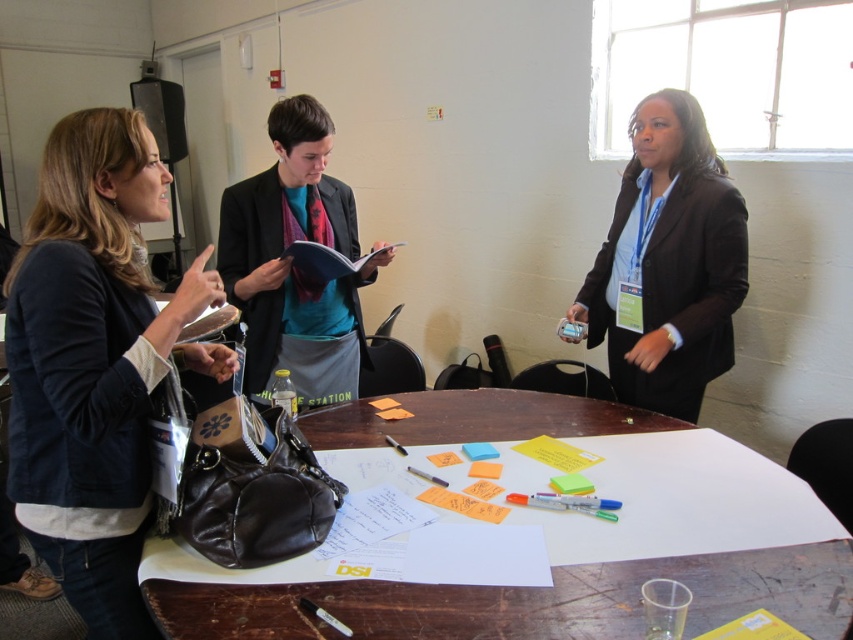
Question: Is dark blue leather jacket at left smaller than black matte blazer at center?

Choices:
 (A) yes
 (B) no

Answer: (A)

Question: Among these points, which one is farthest from the camera?

Choices:
 (A) (103, 545)
 (B) (457, 438)

Answer: (B)

Question: Among these objects, which one is nearest to the camera?

Choices:
 (A) black matte blazer at center
 (B) dark blue leather jacket at left

Answer: (B)

Question: Which point is farther to the camera?

Choices:
 (A) black matte blazer at center
 (B) brown leather table at center

Answer: (A)

Question: Can you confirm if brown leather table at center is positioned to the left of black matte blazer at center?

Choices:
 (A) yes
 (B) no

Answer: (A)

Question: Does brown leather table at center appear over black matte blazer at center?

Choices:
 (A) no
 (B) yes

Answer: (A)